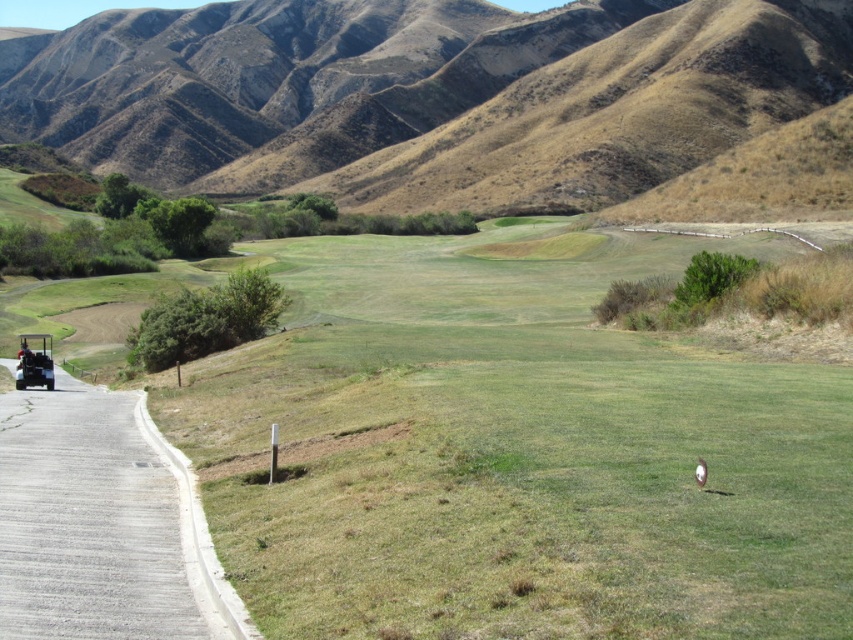
Question: Among these objects, which one is farthest from the camera?

Choices:
 (A) metallic golf cart at left
 (B) brown/dry grassy at upper center
 (C) green grassy field at center

Answer: (B)

Question: Is green grassy field at center to the left of metallic golf cart at left from the viewer's perspective?

Choices:
 (A) no
 (B) yes

Answer: (A)

Question: Considering the relative positions of green grassy field at center and brown/dry grassy at upper center in the image provided, where is green grassy field at center located with respect to brown/dry grassy at upper center?

Choices:
 (A) right
 (B) left

Answer: (A)

Question: Which point appears closest to the camera in this image?

Choices:
 (A) (805, 42)
 (B) (26, 349)

Answer: (B)

Question: Which point is closer to the camera taking this photo?

Choices:
 (A) (22, 355)
 (B) (300, 502)
 (C) (22, 72)

Answer: (B)

Question: Does green grassy field at center have a larger size compared to brown/dry grassy at upper center?

Choices:
 (A) no
 (B) yes

Answer: (A)